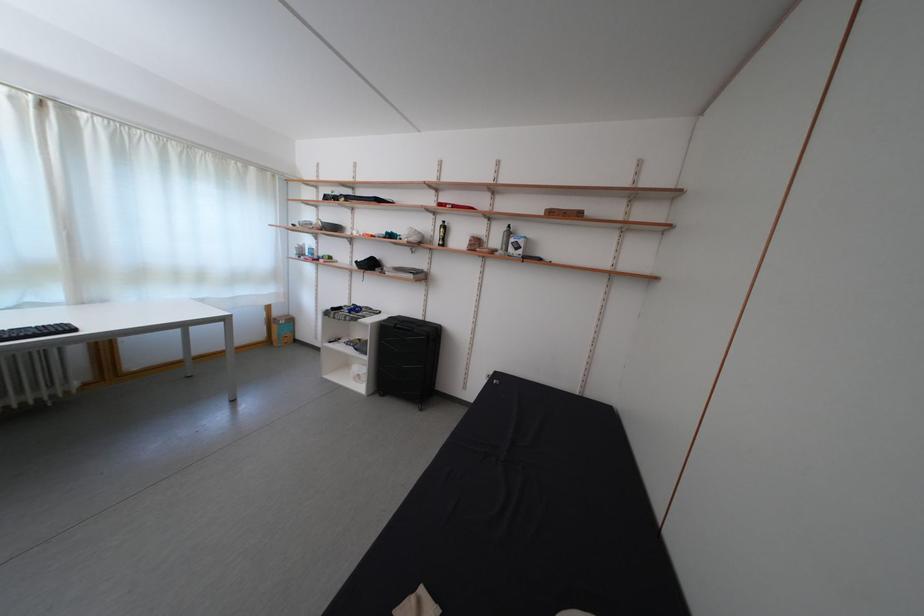
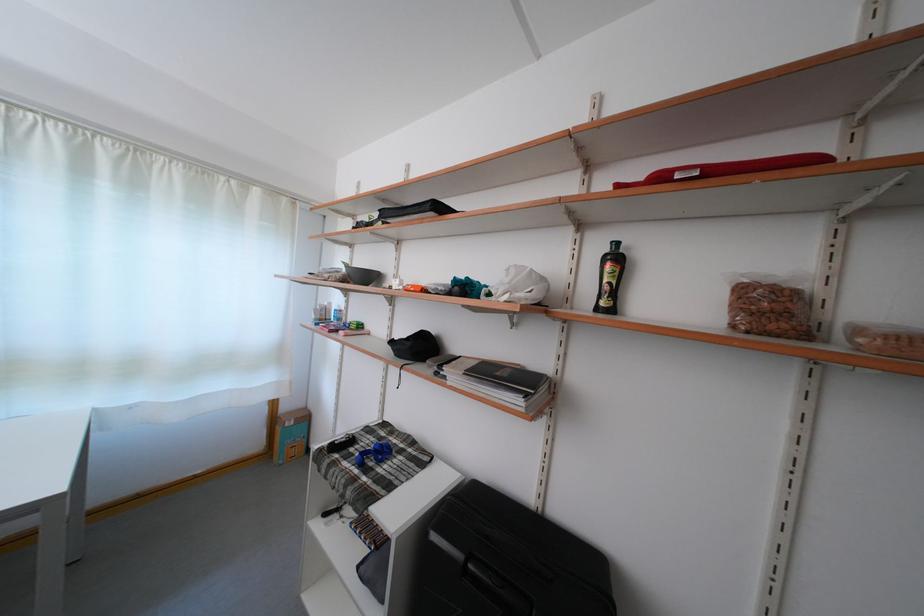
Find the pixel in the second image that matches [448,251] in the first image.

(606, 314)